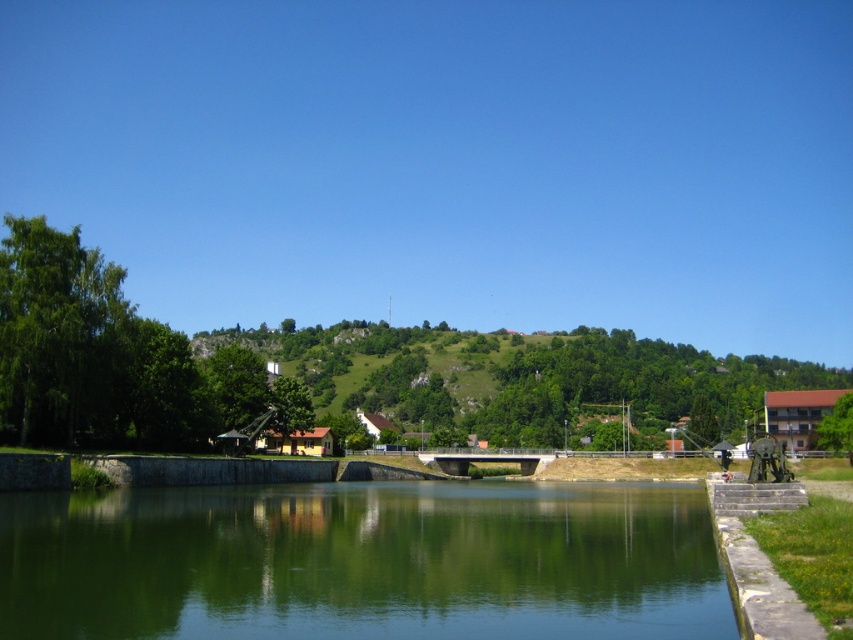
Which is below, green smooth water at center or green grassy hillside at center?

green grassy hillside at center is below.

This screenshot has width=853, height=640. I want to click on green smooth water at center, so click(x=363, y=563).

Is point (375, 515) in front of point (596, 390)?

Yes, it is in front of point (596, 390).

Image resolution: width=853 pixels, height=640 pixels. Find the location of `green smooth water at center`. green smooth water at center is located at coordinates (363, 563).